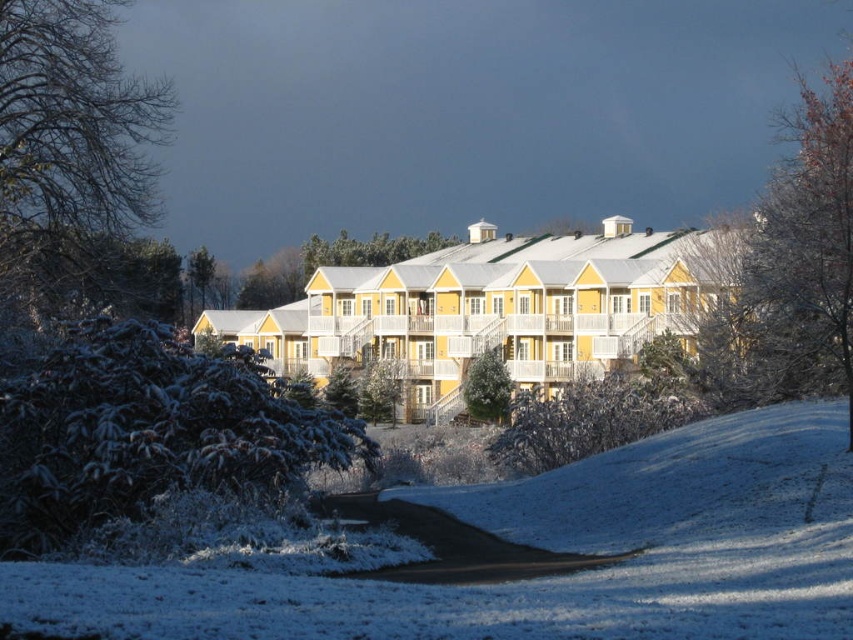
You are standing at the base of the slope in the foreground and want to take a photo of both the bare branches at upper right and the green textured pine tree at center. Which object will appear larger in your camera viewfinder?

The bare branches at upper right will appear larger in the camera viewfinder because it is much taller than the green textured pine tree at center.

You are standing at the base of the hill in the winter scene and notice the bare branches at upper right and the green textured pine tree at center. Which object is closer to you?

The bare branches at upper right are closer to you because they are in front of the green textured pine tree at center.